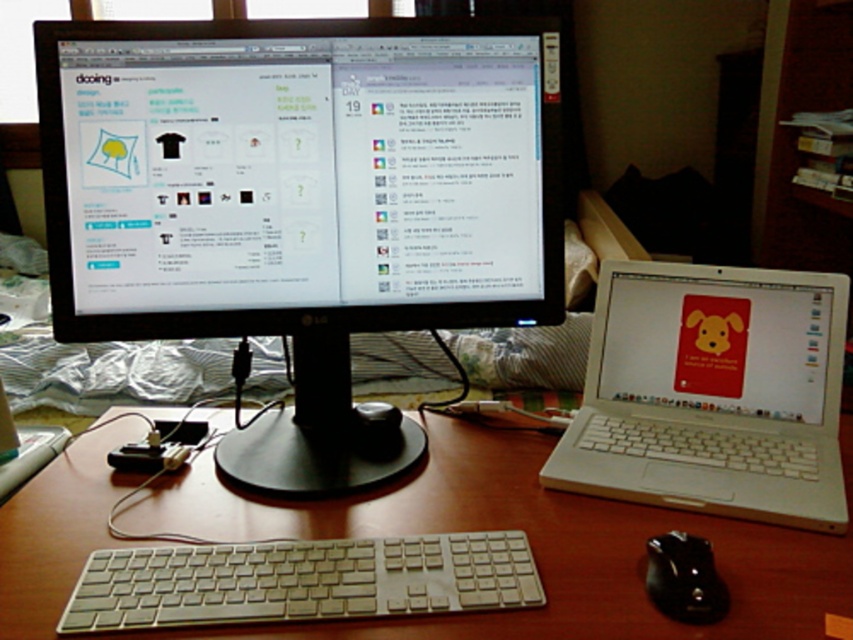
Does point (521, 88) come in front of point (573, 465)?

Yes, it is.

In order to click on black glossy monitor at upper left in this screenshot , I will do `click(302, 204)`.

Can you confirm if wooden desk at center is positioned to the left of white plastic keyboard at center?

In fact, wooden desk at center is to the right of white plastic keyboard at center.

Can you confirm if wooden desk at center is positioned below white plastic keyboard at center?

Actually, wooden desk at center is above white plastic keyboard at center.

Between point (805, 600) and point (265, 589), which one is positioned behind?

The point (805, 600) is more distant.

The width and height of the screenshot is (853, 640). In order to click on wooden desk at center in this screenshot , I will do `click(531, 547)`.

Who is lower down, black glossy monitor at upper left or black rubber mouse at lower right?

Positioned lower is black rubber mouse at lower right.

Is point (190, 26) closer to viewer compared to point (686, 560)?

That is False.

Is point (228, 40) behind point (659, 605)?

Yes, it is behind point (659, 605).

Locate an element on the screen. black glossy monitor at upper left is located at coordinates (302, 204).